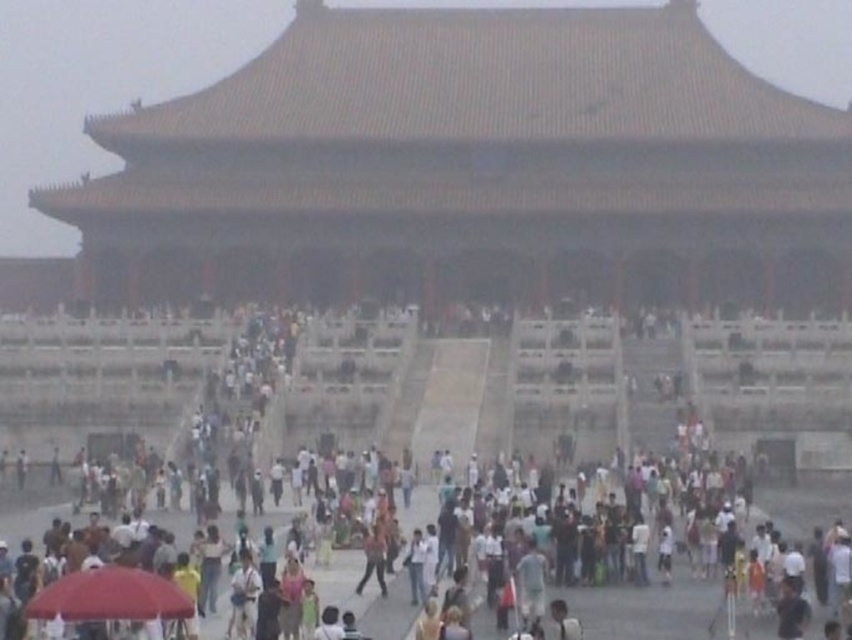
Can you confirm if multicolored casual attire at center is taller than red fabric umbrella at lower left?

Correct, multicolored casual attire at center is much taller as red fabric umbrella at lower left.

Who is higher up, multicolored casual attire at center or red fabric umbrella at lower left?

multicolored casual attire at center

I want to click on multicolored casual attire at center, so click(x=298, y=385).